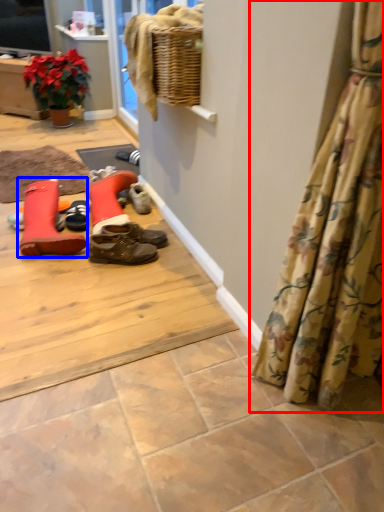
Question: Which point is closer to the camera, curtain (highlighted by a red box) or footwear (highlighted by a blue box)?

Choices:
 (A) curtain
 (B) footwear

Answer: (A)